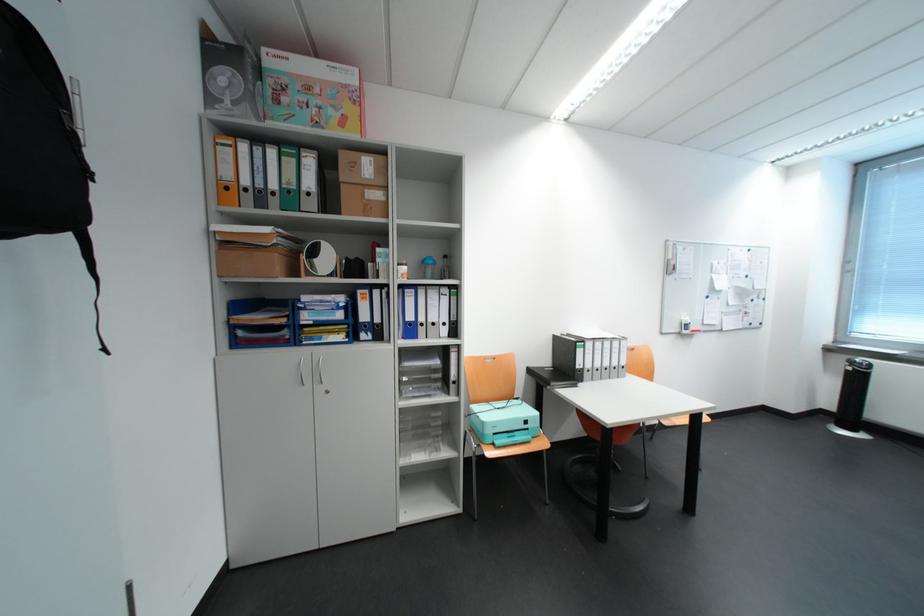
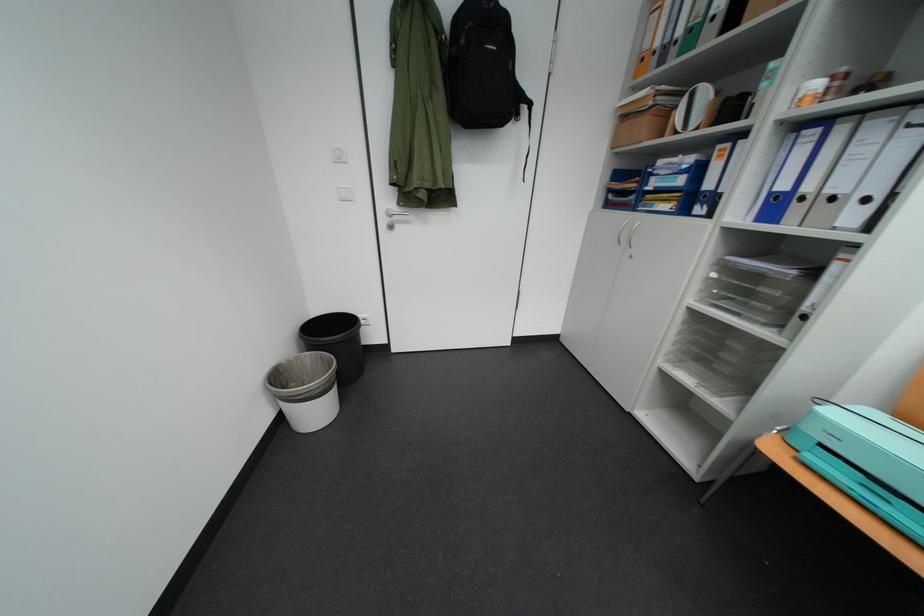
Find the pixel in the second image that matches pixel 505 436 in the first image.

(833, 447)